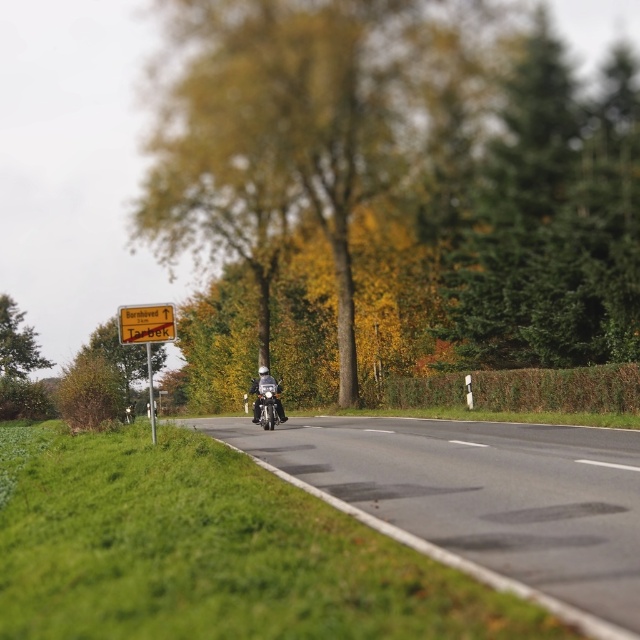
Question: Is green textured tree at upper right smaller than wooden textured sign at upper left?

Choices:
 (A) no
 (B) yes

Answer: (A)

Question: Where is wooden signpost at left located in relation to shiny black motorcycle at center in the image?

Choices:
 (A) right
 (B) left

Answer: (B)

Question: Based on their relative distances, which object is farther from the green textured tree at upper right?

Choices:
 (A) green leafy tree at left
 (B) green leafy tree at center

Answer: (A)

Question: Which object is farther from the camera taking this photo?

Choices:
 (A) green leafy tree at center
 (B) wooden textured sign at upper left
 (C) shiny black motorcycle at center
 (D) wooden signpost at left

Answer: (A)

Question: Can you confirm if green textured tree at upper right is thinner than green leafy tree at left?

Choices:
 (A) yes
 (B) no

Answer: (B)

Question: Considering the real-world distances, which object is closest to the shiny black motorcycle at center?

Choices:
 (A) black asphalt road at center
 (B) green leafy tree at left
 (C) green textured tree at upper right

Answer: (A)